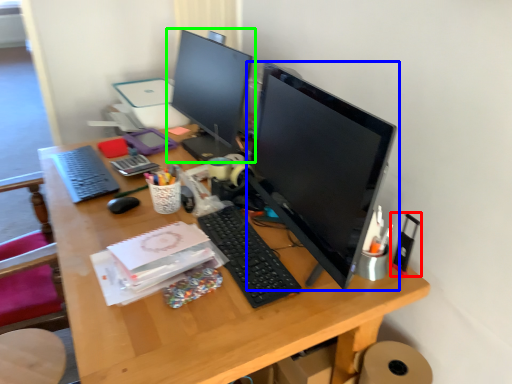
Question: Estimate the real-world distances between objects in this image. Which object is closer to stationery (highlighted by a red box), computer monitor (highlighted by a blue box) or computer monitor (highlighted by a green box)?

Choices:
 (A) computer monitor
 (B) computer monitor

Answer: (A)